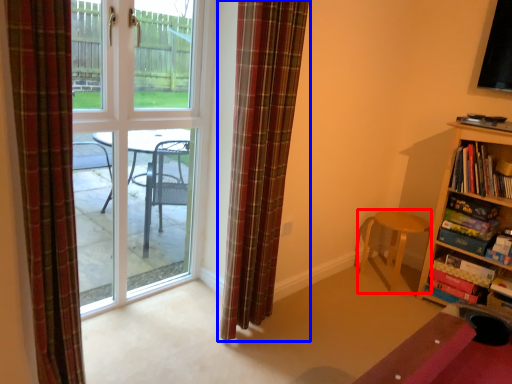
Question: Among these objects, which one is farthest to the camera, chair (highlighted by a red box) or curtain (highlighted by a blue box)?

Choices:
 (A) chair
 (B) curtain

Answer: (A)